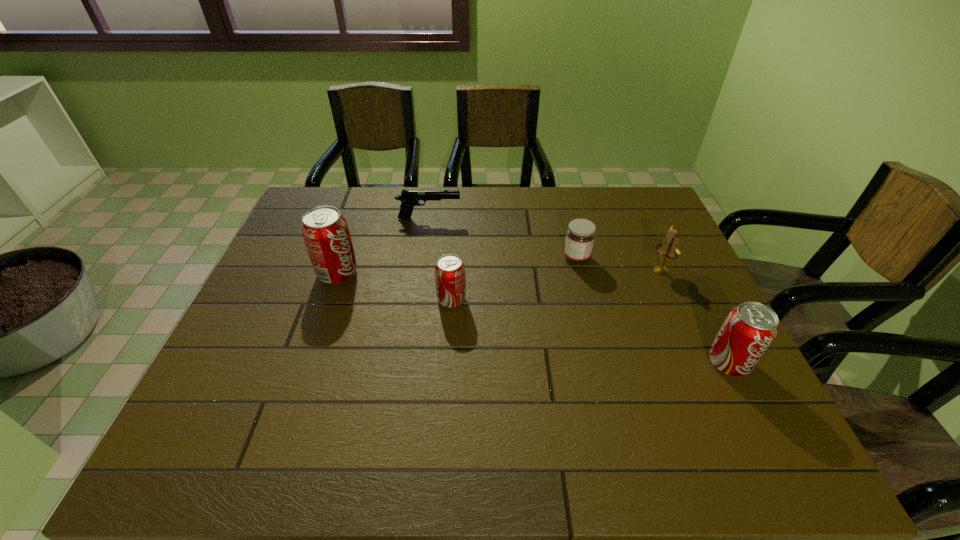
Locate which soda ranks in proximity to the rightmost soda. Please provide its 2D coordinates. Your answer should be formatted as a tuple, i.e. [(x, y)], where the tuple contains the x and y coordinates of a point satisfying the conditions above.

[(450, 280)]

The height and width of the screenshot is (540, 960). I want to click on free region that satisfies the following two spatial constraints: 1. at the aiming end of the rightmost soda; 2. on the left side of the gun, so tap(408, 363).

Find the location of a particular element. This screenshot has height=540, width=960. free spot that satisfies the following two spatial constraints: 1. on the back side of the second soda from right to left; 2. on the right side of the candle holder is located at coordinates (453, 271).

The width and height of the screenshot is (960, 540). I want to click on free space that satisfies the following two spatial constraints: 1. at the aiming end of the second soda from right to left; 2. on the left side of the farthest object, so click(418, 300).

Identify the location of blank space that satisfies the following two spatial constraints: 1. at the aiming end of the farthest object; 2. on the front side of the leftmost object. The image size is (960, 540). (421, 274).

Where is `vacant space that satisfies the following two spatial constraints: 1. on the back side of the jam; 2. at the aiming end of the farthest object`? This screenshot has height=540, width=960. vacant space that satisfies the following two spatial constraints: 1. on the back side of the jam; 2. at the aiming end of the farthest object is located at coordinates (566, 219).

You are a GUI agent. You are given a task and a screenshot of the screen. Output one action in this format:
    pyautogui.click(x=<x>, y=<y>)
    Task: Click on the vacant space that satisfies the following two spatial constraints: 1. at the aiming end of the gun; 2. on the back side of the candle holder
    The height and width of the screenshot is (540, 960).
    Given the screenshot: What is the action you would take?
    pyautogui.click(x=421, y=271)

The height and width of the screenshot is (540, 960). What are the coordinates of `blank area in the image that satisfies the following two spatial constraints: 1. on the back side of the second shortest soda; 2. at the aiming end of the gun` in the screenshot? It's located at (657, 219).

Find the location of a particular element. The image size is (960, 540). free space in the image that satisfies the following two spatial constraints: 1. at the aiming end of the second soda from right to left; 2. on the left side of the gun is located at coordinates (418, 300).